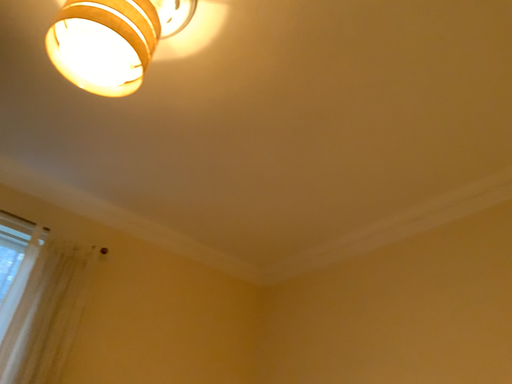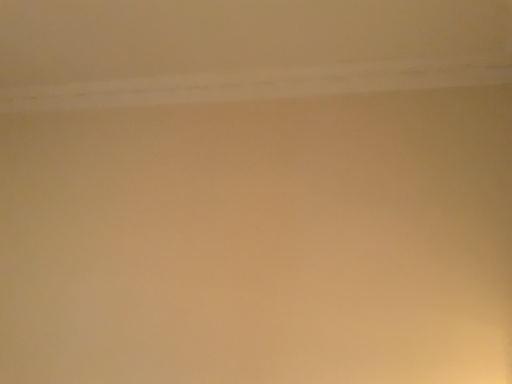
Question: How did the camera likely rotate when shooting the video?

Choices:
 (A) rotated right
 (B) rotated left

Answer: (A)